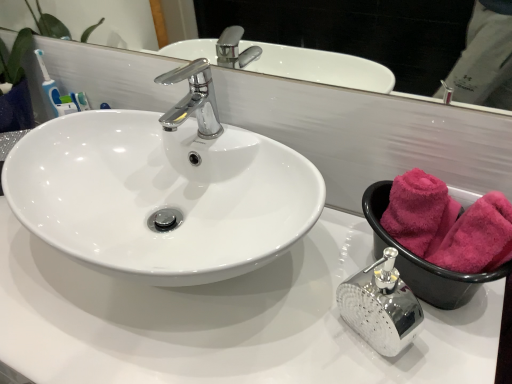
Question: Is pink soft towel at right in front of white glossy sink at center?

Choices:
 (A) yes
 (B) no

Answer: (B)

Question: Does pink soft towel at right come behind white glossy sink at center?

Choices:
 (A) no
 (B) yes

Answer: (B)

Question: From a real-world perspective, is pink soft towel at right physically below white glossy sink at center?

Choices:
 (A) no
 (B) yes

Answer: (B)

Question: Could you tell me if pink soft towel at right is facing white glossy sink at center?

Choices:
 (A) no
 (B) yes

Answer: (A)

Question: Is pink soft towel at right to the right of white glossy sink at center from the viewer's perspective?

Choices:
 (A) yes
 (B) no

Answer: (A)

Question: Do you think white glossy sink at center is within pink fluffy towel at right, which appears as the second bath towel when viewed from the front, or outside of it?

Choices:
 (A) inside
 (B) outside

Answer: (B)

Question: From a real-world perspective, is white glossy sink at center physically located above or below pink fluffy towel at right, arranged as the 1th bath towel when viewed from the back?

Choices:
 (A) above
 (B) below

Answer: (B)

Question: In terms of width, does white glossy sink at center look wider or thinner when compared to pink fluffy towel at right, which appears as the second bath towel when viewed from the front?

Choices:
 (A) thin
 (B) wide

Answer: (B)

Question: Visually, is white glossy sink at center positioned to the left or to the right of pink fluffy towel at right, arranged as the 1th bath towel when viewed from the back?

Choices:
 (A) right
 (B) left

Answer: (B)

Question: Is point (506, 236) closer or farther from the camera than point (8, 14)?

Choices:
 (A) closer
 (B) farther

Answer: (A)

Question: From the image's perspective, relative to glossy white mirror at upper center, is pink fluffy towels at right, positioned as the first bath towel in front-to-back order, above or below?

Choices:
 (A) below
 (B) above

Answer: (A)

Question: Which is correct: pink fluffy towels at right, positioned as the second bath towel in back-to-front order, is inside glossy white mirror at upper center, or outside of it?

Choices:
 (A) outside
 (B) inside

Answer: (A)

Question: From a real-world perspective, is pink fluffy towels at right, positioned as the first bath towel in front-to-back order, physically located above or below glossy white mirror at upper center?

Choices:
 (A) below
 (B) above

Answer: (A)

Question: From the image's perspective, is pink soft towel at right located above or below pink fluffy towel at right, arranged as the 1th bath towel when viewed from the back?

Choices:
 (A) below
 (B) above

Answer: (A)

Question: Is pink soft towel at right wider or thinner than pink fluffy towel at right, which appears as the second bath towel when viewed from the front?

Choices:
 (A) wide
 (B) thin

Answer: (A)